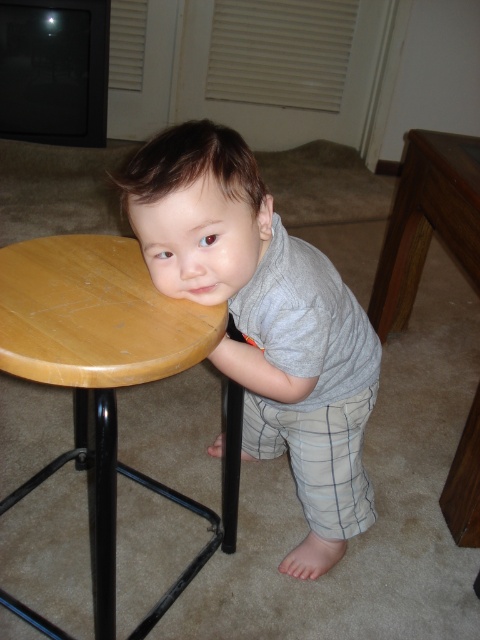
Question: Which point is closer to the camera taking this photo?

Choices:
 (A) (453, 216)
 (B) (111, 605)

Answer: (B)

Question: Can you confirm if gray cotton shirt at center is positioned to the left of wooden round table at lower left?

Choices:
 (A) no
 (B) yes

Answer: (A)

Question: Does gray cotton shirt at center appear under wooden table at right?

Choices:
 (A) no
 (B) yes

Answer: (B)

Question: Which object is closer to the camera taking this photo?

Choices:
 (A) gray cotton shirt at center
 (B) wooden round table at lower left

Answer: (B)

Question: Which of the following is the closest to the observer?

Choices:
 (A) wooden table at right
 (B) wooden at left
 (C) gray cotton shirt at center
 (D) wooden round table at lower left

Answer: (D)

Question: Considering the relative positions of wooden at left and wooden round table at lower left in the image provided, where is wooden at left located with respect to wooden round table at lower left?

Choices:
 (A) left
 (B) right

Answer: (B)